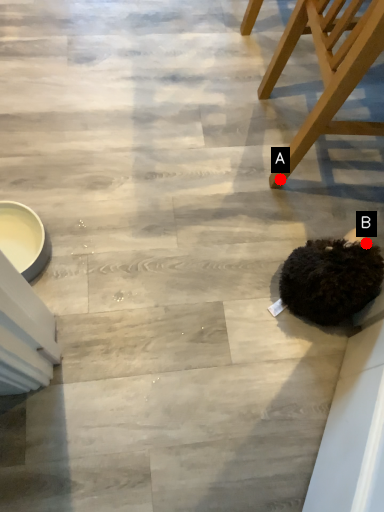
Question: Two points are circled on the image, labeled by A and B beside each circle. Which point is further to the camera?

Choices:
 (A) A is further
 (B) B is further

Answer: (A)